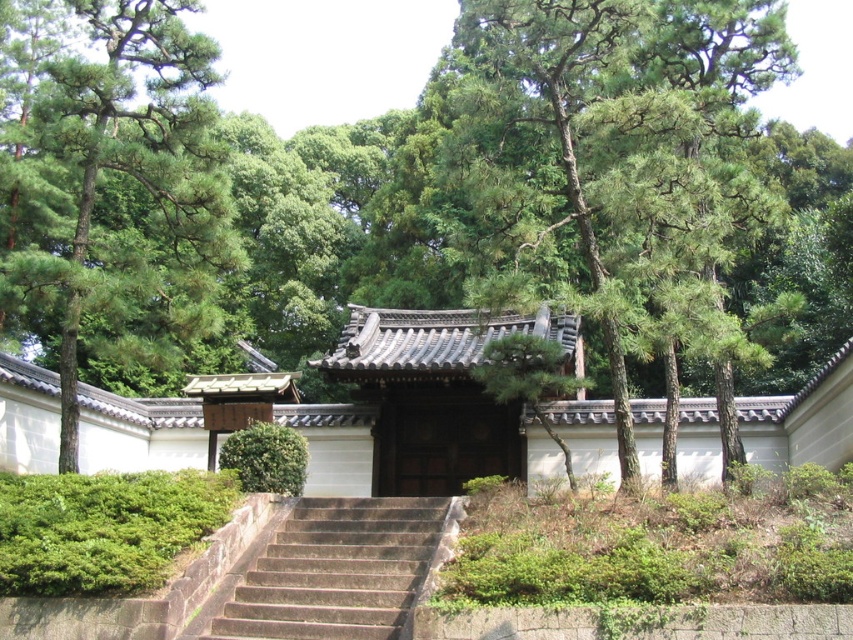
Looking at this image, can you confirm if green leafy tree at left is bigger than brown stone stairs at center?

Yes.

Does point (41, 314) come in front of point (346, 600)?

No, (41, 314) is further to viewer.

This screenshot has height=640, width=853. Identify the location of green leafy tree at left. (120, 195).